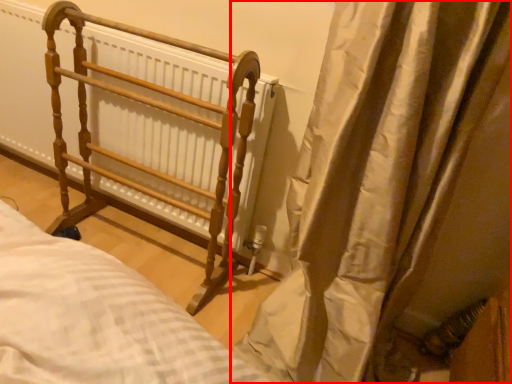
Question: Observing the image, what is the correct spatial positioning of curtain (annotated by the red box) in reference to furniture?

Choices:
 (A) left
 (B) right

Answer: (B)